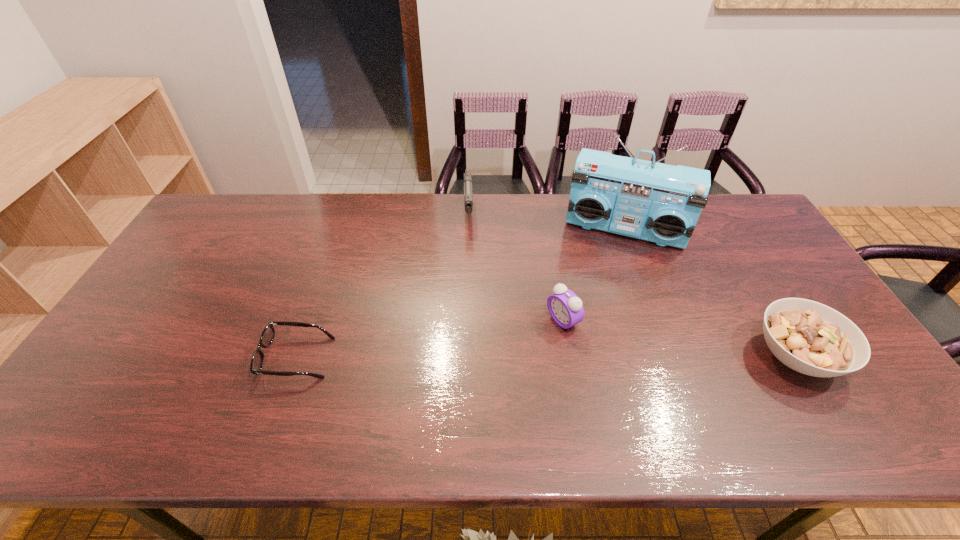
Locate an element on the screen. spectacles is located at coordinates (268, 334).

Where is `the leftmost object`? The width and height of the screenshot is (960, 540). the leftmost object is located at coordinates (268, 334).

Locate an element on the screen. The height and width of the screenshot is (540, 960). stew is located at coordinates (809, 337).

Identify the location of gun. The image size is (960, 540). (468, 198).

Locate an element on the screen. This screenshot has height=540, width=960. the tallest object is located at coordinates (661, 204).

Find the location of a particular element. This screenshot has width=960, height=540. the third object from left to right is located at coordinates (566, 309).

At what (x,y) coordinates should I click in order to perform the action: click on vacant space located 0.170m on the lenses of the shortest object. Please return your answer as a coordinate pair (x, y). Looking at the image, I should click on (198, 358).

In order to click on free space located on the lenses of the shortest object in this screenshot , I will do `click(189, 358)`.

You are a GUI agent. You are given a task and a screenshot of the screen. Output one action in this format:
    pyautogui.click(x=<x>, y=<y>)
    Task: Click on the free point located 0.210m on the lenses of the shortest object
    
    Given the screenshot: What is the action you would take?
    pyautogui.click(x=181, y=358)

Locate an element on the screen. This screenshot has width=960, height=540. free region located 0.120m on the left of the stew is located at coordinates (705, 356).